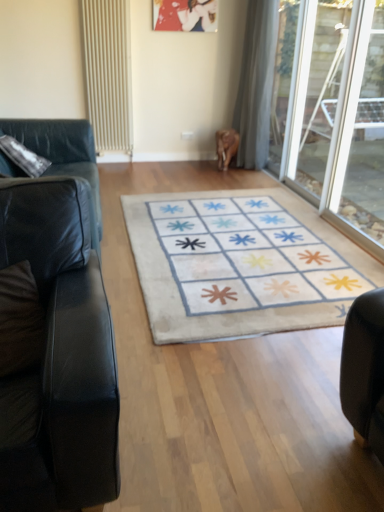
This screenshot has width=384, height=512. I want to click on vacant space underneath metallic silver picture frame at upper center (from a real-world perspective), so click(x=176, y=157).